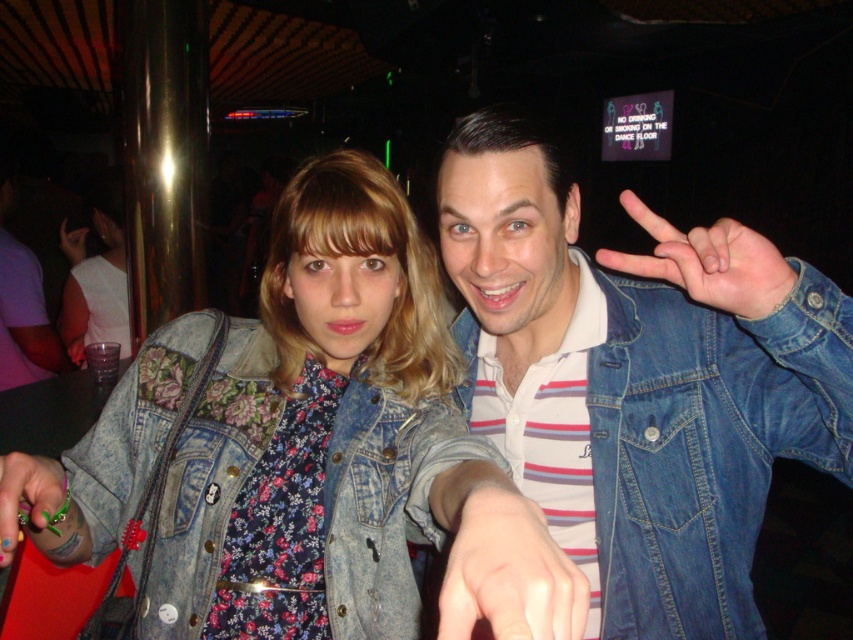
Who is higher up, matte skin hand at center or denim at right?

denim at right is above.

Which is behind, point (506, 506) or point (706, 262)?

Point (706, 262)

Is point (518, 612) less distant than point (711, 282)?

Yes, point (518, 612) is closer to viewer.

The height and width of the screenshot is (640, 853). Find the location of `matte skin hand at center`. matte skin hand at center is located at coordinates (502, 563).

Is denim jacket at center below green plastic ring at lower left?

Incorrect, denim jacket at center is not positioned below green plastic ring at lower left.

The height and width of the screenshot is (640, 853). What are the coordinates of `denim jacket at center` in the screenshot? It's located at (637, 380).

Between faded denim jacket at center and floral fabric dress at center, which one is positioned higher?

Positioned higher is floral fabric dress at center.

Which is in front, point (186, 557) or point (100, 196)?

Point (186, 557) is in front.

Find the location of a particular element. Image resolution: width=853 pixels, height=640 pixels. faded denim jacket at center is located at coordinates (178, 460).